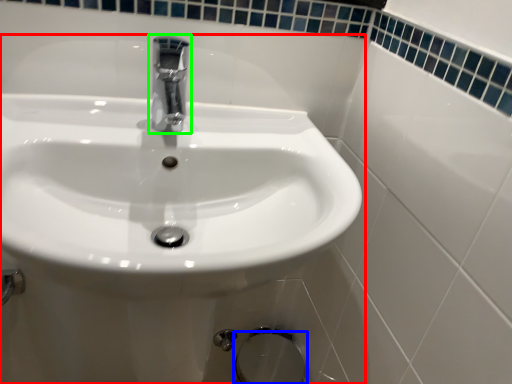
Question: Based on their relative distances, which object is farther from sink (highlighted by a red box)? Choose from bidet (highlighted by a blue box) and tap (highlighted by a green box).

Choices:
 (A) bidet
 (B) tap

Answer: (A)